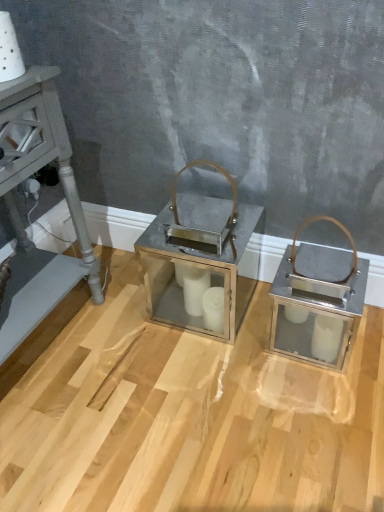
Where is `vacant point to the right of metallic gray side table at left`? The height and width of the screenshot is (512, 384). vacant point to the right of metallic gray side table at left is located at coordinates (129, 360).